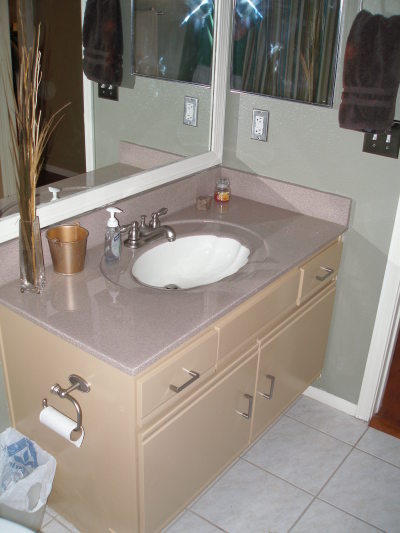
The image size is (400, 533). Find the location of `trash can`. trash can is located at coordinates (20, 461).